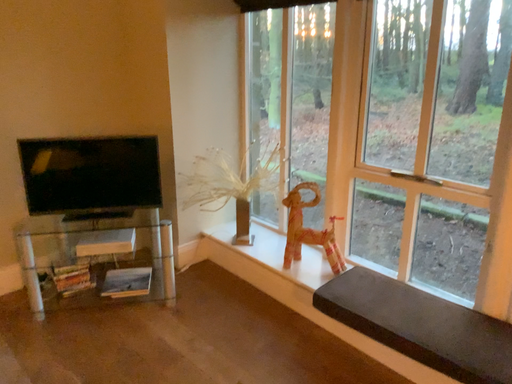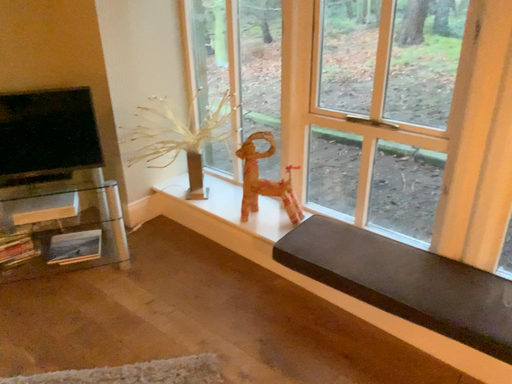
Question: How did the camera likely rotate when shooting the video?

Choices:
 (A) rotated right
 (B) rotated left

Answer: (A)